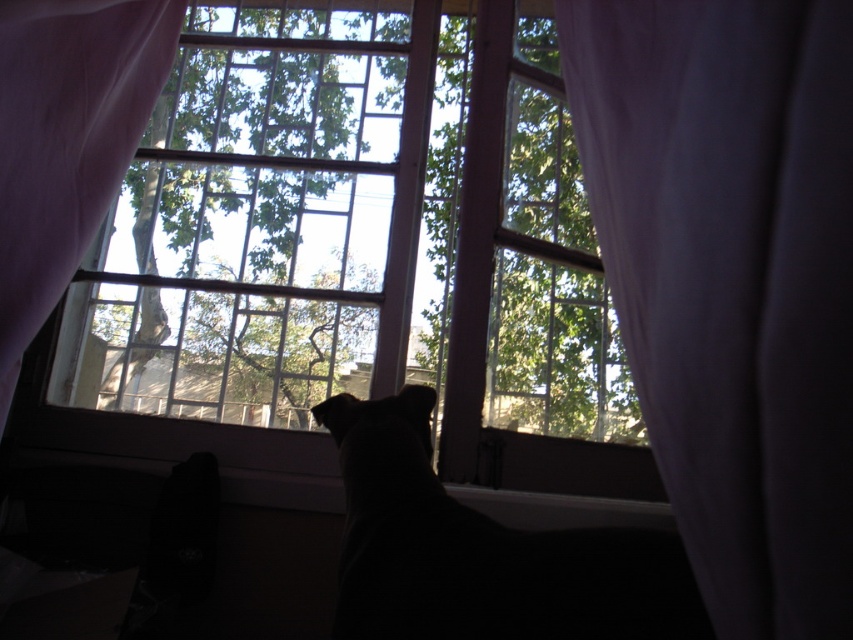
Can you confirm if clear glass window at center is positioned above black fur cat at center?

Correct, clear glass window at center is located above black fur cat at center.

Is point (222, 93) more distant than point (408, 624)?

Yes, point (222, 93) is behind point (408, 624).

Identify the location of clear glass window at center. (352, 253).

How much distance is there between black fur cat at center and white sheer curtain at left?

black fur cat at center is 19.58 inches away from white sheer curtain at left.

Find the location of a particular element. black fur cat at center is located at coordinates (482, 552).

Does point (538, 544) lie behind point (173, 38)?

That is False.

What are the coordinates of `black fur cat at center` in the screenshot? It's located at (482, 552).

Does white sheer curtain at right have a larger size compared to black fur cat at center?

Actually, white sheer curtain at right might be smaller than black fur cat at center.

Between white sheer curtain at right and black fur cat at center, which one appears on the left side from the viewer's perspective?

Positioned to the left is black fur cat at center.

You are a GUI agent. You are given a task and a screenshot of the screen. Output one action in this format:
    pyautogui.click(x=<x>, y=<y>)
    Task: Click on the white sheer curtain at right
    
    Given the screenshot: What is the action you would take?
    pyautogui.click(x=732, y=280)

The width and height of the screenshot is (853, 640). I want to click on white sheer curtain at right, so click(x=732, y=280).